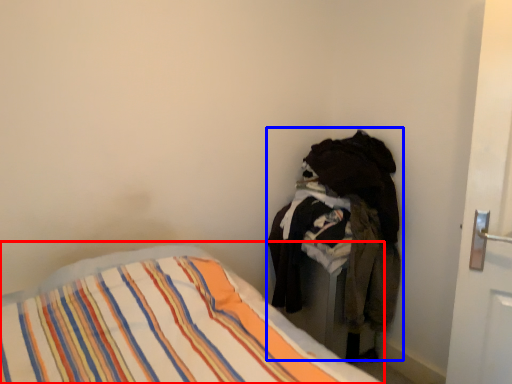
Question: Which point is closer to the camera, bed (highlighted by a red box) or laundry (highlighted by a blue box)?

Choices:
 (A) bed
 (B) laundry

Answer: (A)